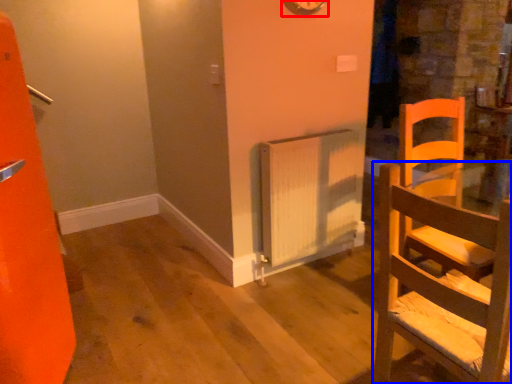
Question: Which of the following is the farthest to the observer, clock (highlighted by a red box) or chair (highlighted by a blue box)?

Choices:
 (A) clock
 (B) chair

Answer: (A)